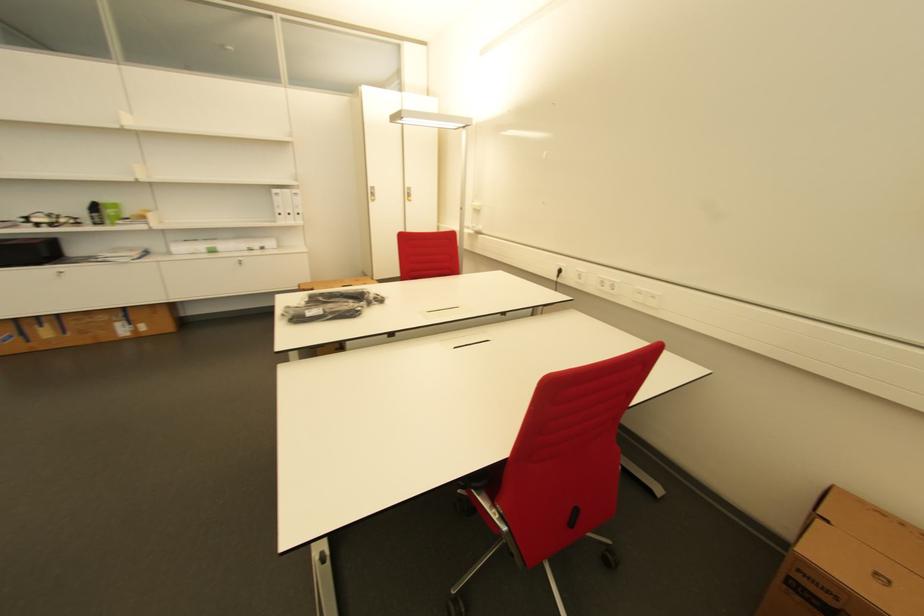
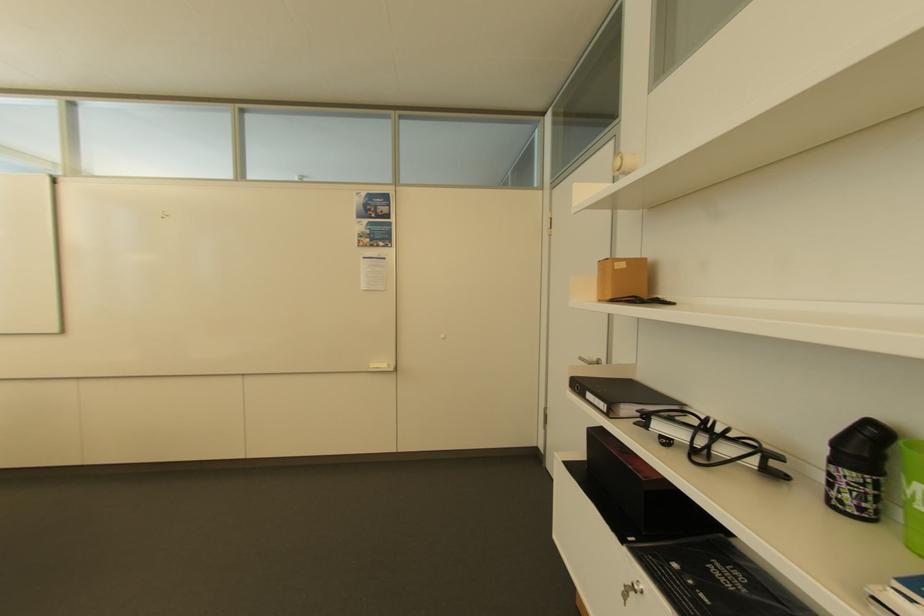
Find the pixel in the second image that matches [68,222] in the first image.

(728, 452)